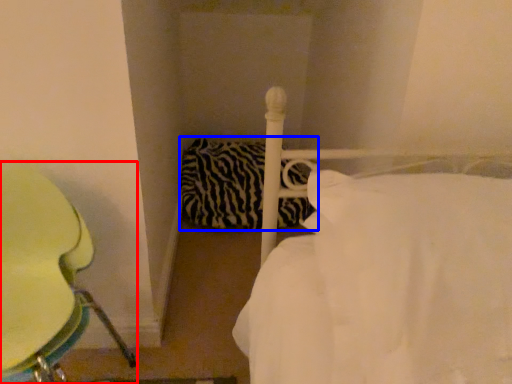
Question: Which object is further to the camera taking this photo, furniture (highlighted by a red box) or pillow (highlighted by a blue box)?

Choices:
 (A) furniture
 (B) pillow

Answer: (B)